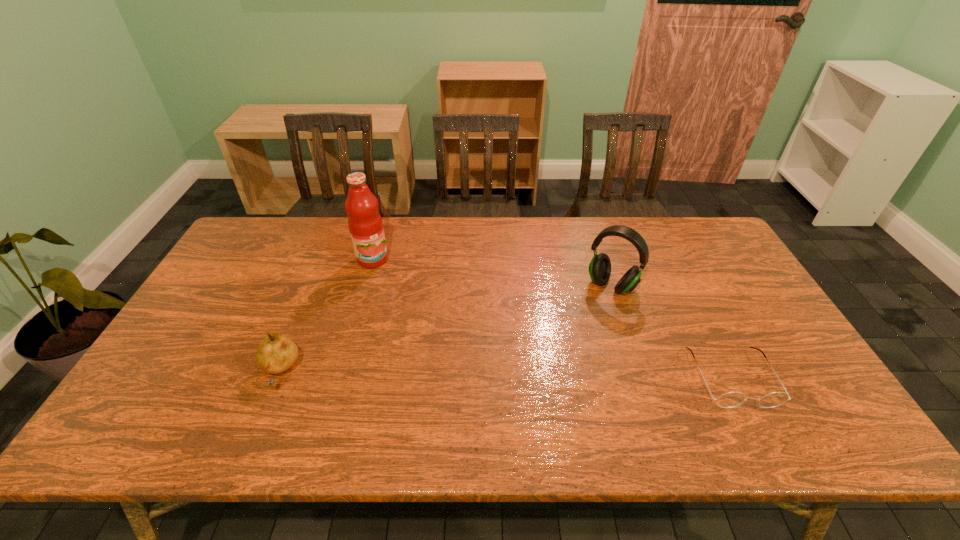
Locate an element on the screen. The width and height of the screenshot is (960, 540). the second shortest object is located at coordinates (275, 353).

Locate an element on the screen. pear is located at coordinates (275, 353).

Where is `the rightmost object`? the rightmost object is located at coordinates 728,400.

Where is `the shortest object`? This screenshot has width=960, height=540. the shortest object is located at coordinates (728, 400).

Locate an element on the screen. The width and height of the screenshot is (960, 540). the farthest object is located at coordinates (365, 224).

I want to click on the second object from left to right, so click(365, 224).

I want to click on the second tallest object, so click(x=600, y=266).

Image resolution: width=960 pixels, height=540 pixels. I want to click on the third nearest object, so click(600, 266).

You are a GUI agent. You are given a task and a screenshot of the screen. Output one action in this format:
    pyautogui.click(x=<x>, y=<y>)
    Task: Click on the vacant space situated 0.390m on the back of the pear
    
    Given the screenshot: What is the action you would take?
    pyautogui.click(x=327, y=256)

At what (x,y) coordinates should I click in order to perform the action: click on vacant region located 0.270m on the front label of the tallest object. Please return your answer as a coordinate pair (x, y). The image size is (960, 540). Looking at the image, I should click on (415, 322).